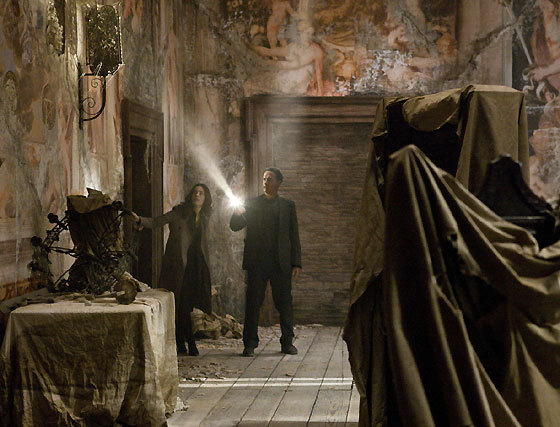
At what (x,y) coordinates should I click in order to perform the action: click on door. Please return your answer as a coordinate pair (x, y). This screenshot has width=560, height=427. Looking at the image, I should click on (144, 181).